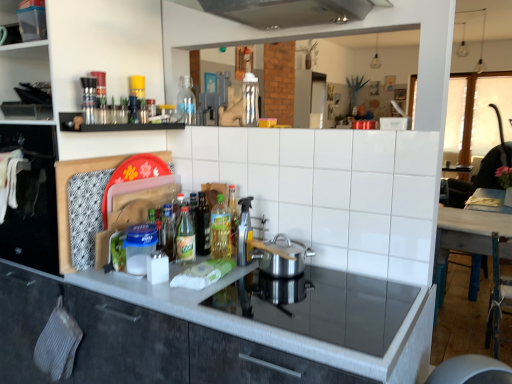
Question: Should I look upward or downward to see transparent plastic container at upper left, which is the first shelf in left-to-right order?

Choices:
 (A) up
 (B) down

Answer: (A)

Question: Is translucent plastic bottle at center, the fourth bottle in the left-to-right sequence, to the left of matte gray cabinetry at center from the viewer's perspective?

Choices:
 (A) yes
 (B) no

Answer: (A)

Question: Does translucent plastic bottle at center, placed as the third bottle when sorted from back to front, have a lesser width compared to matte gray cabinetry at center?

Choices:
 (A) yes
 (B) no

Answer: (A)

Question: Is translucent plastic bottle at center, placed as the third bottle when sorted from back to front, taller than matte gray cabinetry at center?

Choices:
 (A) yes
 (B) no

Answer: (B)

Question: Would you say matte gray cabinetry at center is part of translucent plastic bottle at center, the fourth bottle in the left-to-right sequence,'s contents?

Choices:
 (A) no
 (B) yes

Answer: (A)

Question: Considering the relative sizes of translucent plastic bottle at center, which appears as the second bottle when ordered from the bottom, and matte gray cabinetry at center in the image provided, is translucent plastic bottle at center, which appears as the second bottle when ordered from the bottom, wider than matte gray cabinetry at center?

Choices:
 (A) no
 (B) yes

Answer: (A)

Question: Is black matte shelf at upper left, positioned as the second shelf in left-to-right order, shorter than translucent glass bottle at center, the third bottle positioned from the front?

Choices:
 (A) yes
 (B) no

Answer: (A)

Question: Is black matte shelf at upper left, positioned as the second shelf in left-to-right order, to the left of translucent glass bottle at center, the 1th bottle positioned from the left, from the viewer's perspective?

Choices:
 (A) yes
 (B) no

Answer: (A)

Question: Is black matte shelf at upper left, positioned as the second shelf in left-to-right order, in front of translucent glass bottle at center, which is the 3th bottle in bottom-to-top order?

Choices:
 (A) no
 (B) yes

Answer: (B)

Question: Is black matte shelf at upper left, the second shelf when ordered from top to bottom, facing towards translucent glass bottle at center, the 1th bottle positioned from the left?

Choices:
 (A) yes
 (B) no

Answer: (B)

Question: From the image's perspective, is black matte shelf at upper left, the second shelf when ordered from top to bottom, over translucent glass bottle at center, acting as the 2th bottle starting from the back?

Choices:
 (A) yes
 (B) no

Answer: (A)

Question: Is black matte shelf at upper left, positioned as the second shelf in left-to-right order, in contact with translucent glass bottle at center, the third bottle positioned from the front?

Choices:
 (A) yes
 (B) no

Answer: (B)

Question: Is translucent glass bottle at center, which is the 3th bottle in bottom-to-top order, further to the viewer compared to clear glass bottle at center, arranged as the first bottle when viewed from the top?

Choices:
 (A) yes
 (B) no

Answer: (B)